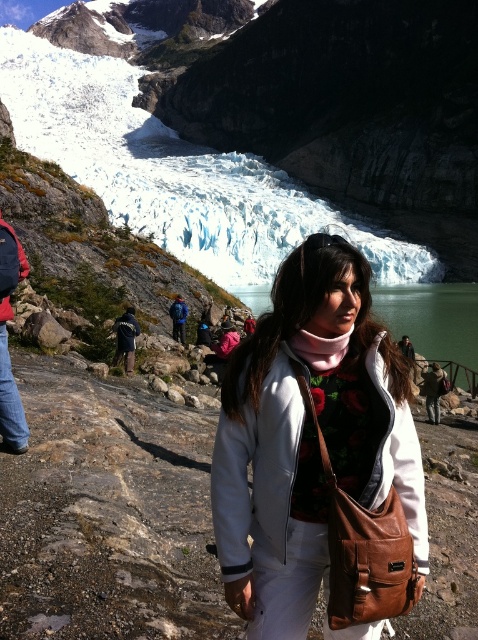
Question: Which point appears farthest from the camera in this image?

Choices:
 (A) (324, 305)
 (B) (77, 176)
 (C) (10, 305)

Answer: (B)

Question: Which of the following is the closest to the observer?

Choices:
 (A) white leather jacket at center
 (B) brushed metal backpack at left

Answer: (A)

Question: Is white ice glacier at upper center closer to the viewer compared to green glassy lake at center?

Choices:
 (A) no
 (B) yes

Answer: (A)

Question: Can you confirm if white ice glacier at upper center is thinner than brushed metal backpack at left?

Choices:
 (A) yes
 (B) no

Answer: (B)

Question: Which of these objects is positioned farthest from the white leather jacket at center?

Choices:
 (A) brushed metal backpack at left
 (B) white ice glacier at upper center

Answer: (B)

Question: Does white leather jacket at center appear on the right side of white ice glacier at upper center?

Choices:
 (A) yes
 (B) no

Answer: (A)